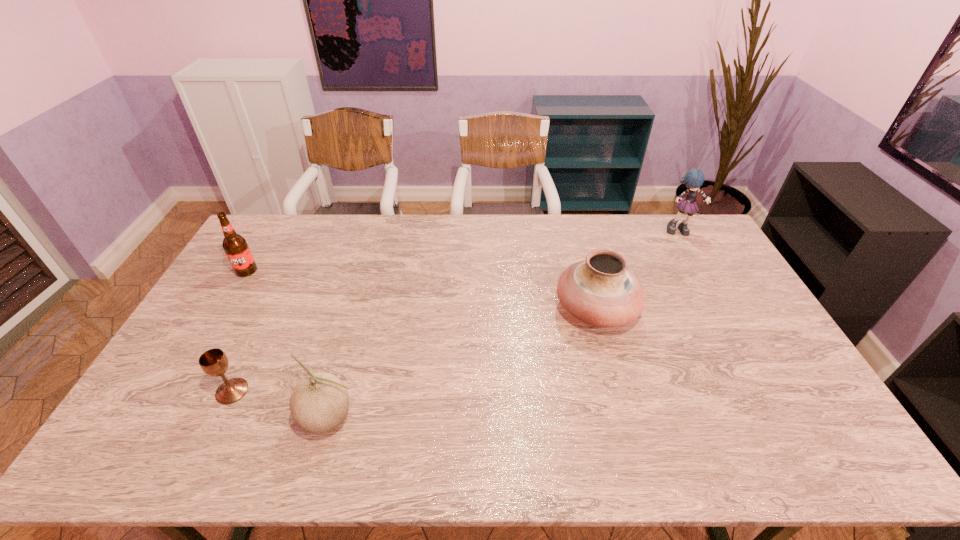
Find the location of a particular element. The width and height of the screenshot is (960, 540). free space at the near edge of the desktop is located at coordinates (276, 465).

The width and height of the screenshot is (960, 540). I want to click on free space at the left edge of the desktop, so click(263, 285).

At what (x,y) coordinates should I click in order to perform the action: click on free space at the right edge of the desktop. Please return your answer as a coordinate pair (x, y). The height and width of the screenshot is (540, 960). Looking at the image, I should click on (688, 257).

In order to click on vacant area that lies between the pottery and the rag doll in this screenshot , I will do `click(638, 270)`.

Identify the location of free spot between the pottery and the cantaloup. (463, 364).

Find the location of a particular element. free point between the shortest object and the farthest object is located at coordinates (457, 311).

Find the location of a particular element. The image size is (960, 540). free spot between the shortest object and the cantaloup is located at coordinates (281, 405).

At what (x,y) coordinates should I click in order to perform the action: click on vacant space that's between the shortest object and the cantaloup. Please return your answer as a coordinate pair (x, y). The width and height of the screenshot is (960, 540). Looking at the image, I should click on pos(281,405).

I want to click on free area in between the fourth object from right to left and the cantaloup, so click(281, 405).

The height and width of the screenshot is (540, 960). I want to click on empty space between the cantaloup and the rag doll, so click(x=505, y=325).